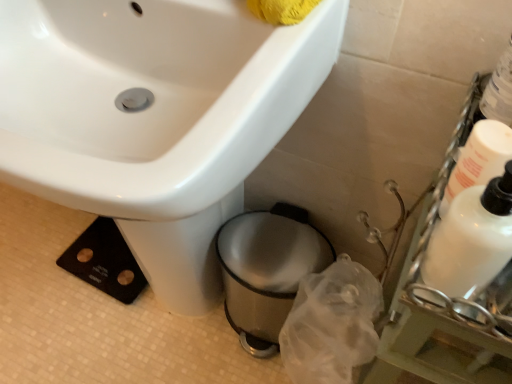
Locate an element on the screen. vacant space that is to the left of shiny metallic trash can at lower center is located at coordinates (179, 340).